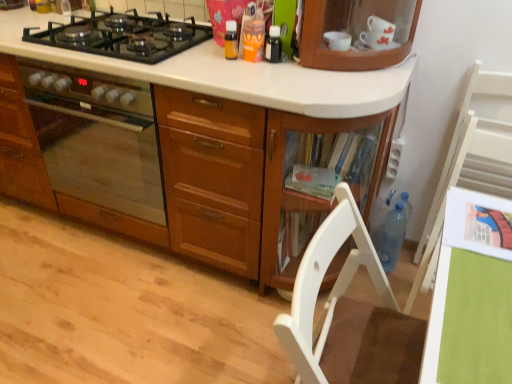
Question: Could you tell me if white wood chair at lower right, the 2th chair positioned from the right, is turned towards blue translucent bottle at lower right?

Choices:
 (A) yes
 (B) no

Answer: (B)

Question: Can you confirm if white wood chair at lower right, acting as the 1th chair starting from the front, is wider than blue translucent bottle at lower right?

Choices:
 (A) no
 (B) yes

Answer: (B)

Question: Is white wood chair at lower right, positioned as the second chair in back-to-front order, closer to camera compared to blue translucent bottle at lower right?

Choices:
 (A) yes
 (B) no

Answer: (A)

Question: Is white wood chair at lower right, the 2th chair positioned from the right, positioned with its back to blue translucent bottle at lower right?

Choices:
 (A) no
 (B) yes

Answer: (A)

Question: Is white wood chair at lower right, acting as the 1th chair starting from the front, shorter than blue translucent bottle at lower right?

Choices:
 (A) yes
 (B) no

Answer: (B)

Question: Is point (233, 49) positioned closer to the camera than point (392, 211)?

Choices:
 (A) farther
 (B) closer

Answer: (B)

Question: From the image's perspective, is translucent plastic bottle at upper center, marked as the 1th kitchen appliance in a left-to-right arrangement, located above or below blue translucent bottle at lower right?

Choices:
 (A) below
 (B) above

Answer: (B)

Question: In terms of height, does translucent plastic bottle at upper center, the third kitchen appliance when ordered from right to left, look taller or shorter compared to blue translucent bottle at lower right?

Choices:
 (A) short
 (B) tall

Answer: (A)

Question: Is translucent plastic bottle at upper center, the third kitchen appliance when ordered from right to left, to the left or to the right of blue translucent bottle at lower right in the image?

Choices:
 (A) left
 (B) right

Answer: (A)

Question: Is point (347, 261) positioned closer to the camera than point (415, 248)?

Choices:
 (A) farther
 (B) closer

Answer: (B)

Question: Is white wood chair at lower right, which ranks as the 1th chair in left-to-right order, taller or shorter than white wood chair at right, which is counted as the 1th chair, starting from the back?

Choices:
 (A) tall
 (B) short

Answer: (B)

Question: In terms of width, does white wood chair at lower right, acting as the 1th chair starting from the front, look wider or thinner when compared to white wood chair at right, the 2th chair when ordered from front to back?

Choices:
 (A) wide
 (B) thin

Answer: (A)

Question: Is white wood chair at lower right, the 2th chair positioned from the right, to the left or to the right of white wood chair at right, positioned as the 1th chair in right-to-left order, in the image?

Choices:
 (A) right
 (B) left

Answer: (B)

Question: Does point (391, 261) appear closer or farther from the camera than point (278, 52)?

Choices:
 (A) farther
 (B) closer

Answer: (A)

Question: Visually, is blue translucent bottle at lower right positioned to the left or to the right of black glass bottle at upper center, which ranks as the 3th kitchen appliance in left-to-right order?

Choices:
 (A) right
 (B) left

Answer: (A)